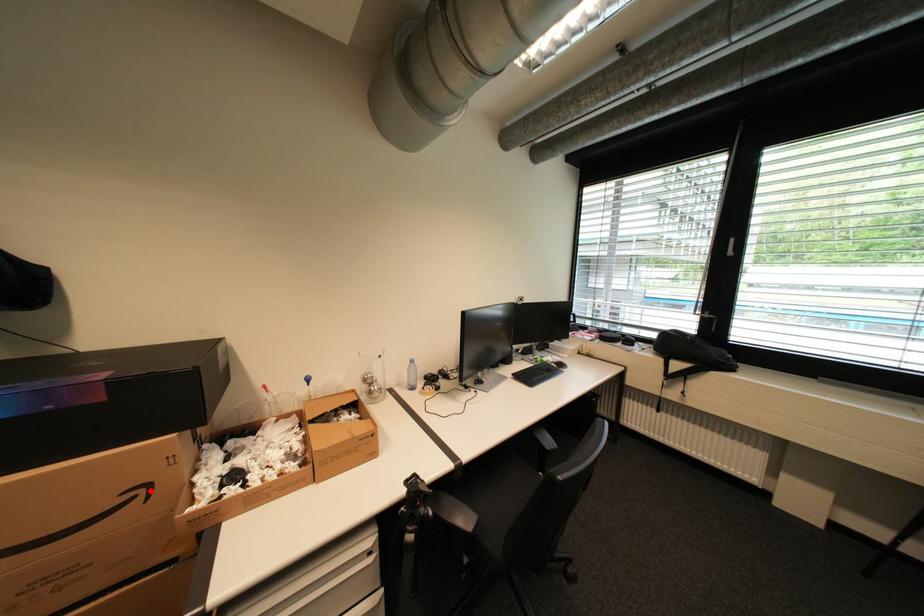
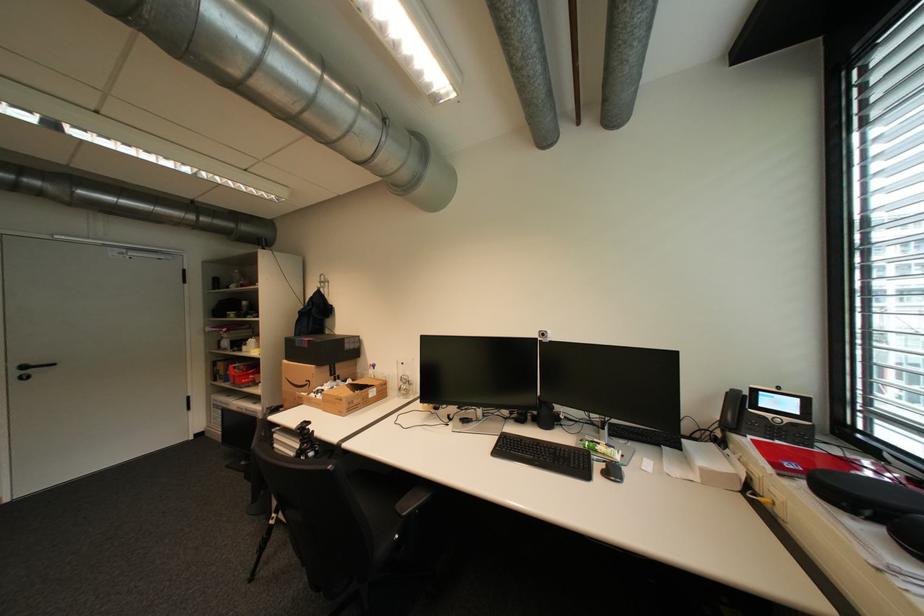
Locate, in the second image, the point that corresponds to the highlighted location in the first image.

(317, 383)